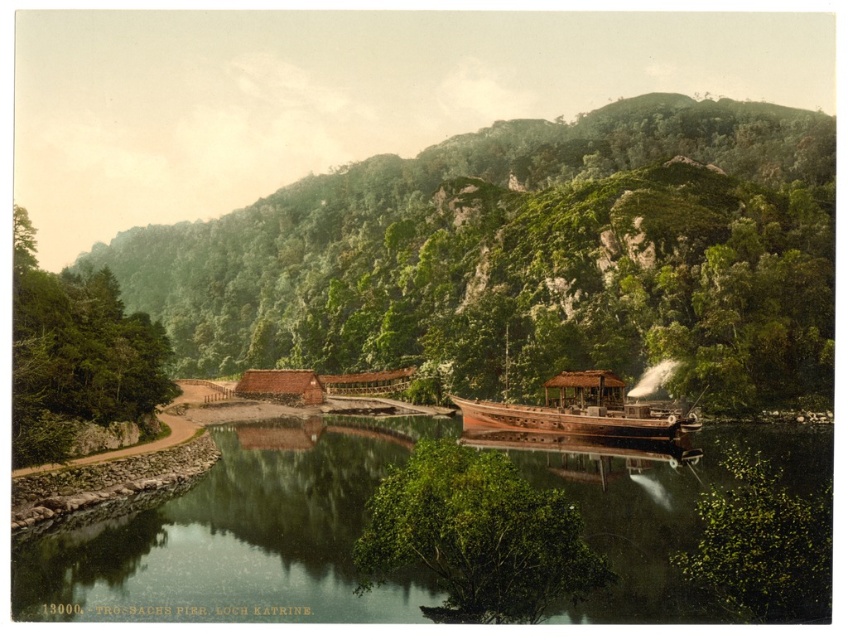
Question: In this image, where is green leafy mountain at center located relative to green leafy trees at left?

Choices:
 (A) right
 (B) left

Answer: (A)

Question: Based on their relative distances, which object is farther from the wooden steamboat at right?

Choices:
 (A) green leafy bush at center
 (B) green leafy plant at lower right
 (C) green smooth water at center
 (D) green leafy trees at left

Answer: (D)

Question: Does green leafy trees at left lie in front of green leafy plant at lower right?

Choices:
 (A) no
 (B) yes

Answer: (A)

Question: Does green leafy mountain at center have a lesser width compared to green smooth water at center?

Choices:
 (A) yes
 (B) no

Answer: (B)

Question: Which point appears farthest from the camera in this image?

Choices:
 (A) (778, 616)
 (B) (523, 577)

Answer: (B)

Question: Which point is closer to the camera taking this photo?

Choices:
 (A) (734, 506)
 (B) (478, 417)
 (C) (399, 493)

Answer: (A)